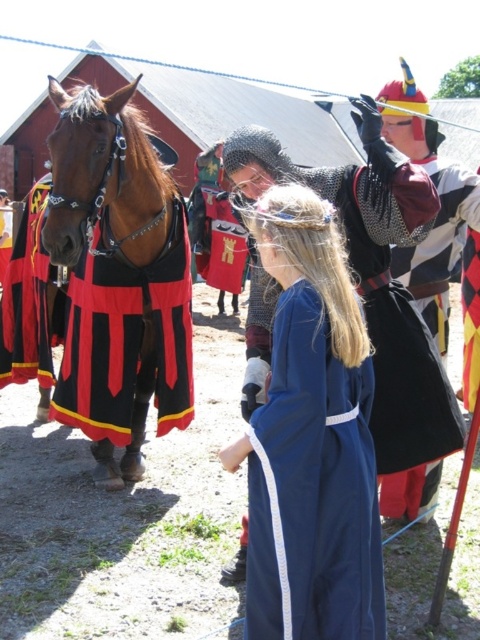
Who is shorter, blue satin dress at center or shiny brown horse at left?

With less height is blue satin dress at center.

Can you confirm if blue satin dress at center is shorter than shiny brown horse at left?

Yes, blue satin dress at center is shorter than shiny brown horse at left.

The width and height of the screenshot is (480, 640). Find the location of `blue satin dress at center`. blue satin dress at center is located at coordinates (311, 438).

Identify the location of blue satin dress at center. (311, 438).

Who is shorter, shiny brown horse at left or chainmail armor at center?

chainmail armor at center

Is shiny brown horse at left in front of chainmail armor at center?

No.

Locate an element on the screen. This screenshot has width=480, height=640. shiny brown horse at left is located at coordinates (118, 278).

Is blue satin dress at center taller than chainmail armor at center?

Incorrect, blue satin dress at center's height is not larger of chainmail armor at center's.

Is blue satin dress at center below chainmail armor at center?

Correct, blue satin dress at center is located below chainmail armor at center.

This screenshot has width=480, height=640. What do you see at coordinates (311, 438) in the screenshot?
I see `blue satin dress at center` at bounding box center [311, 438].

You are a GUI agent. You are given a task and a screenshot of the screen. Output one action in this format:
    pyautogui.click(x=<x>, y=<y>)
    Task: Click on the blue satin dress at center
    This screenshot has height=640, width=480.
    Given the screenshot: What is the action you would take?
    pyautogui.click(x=311, y=438)